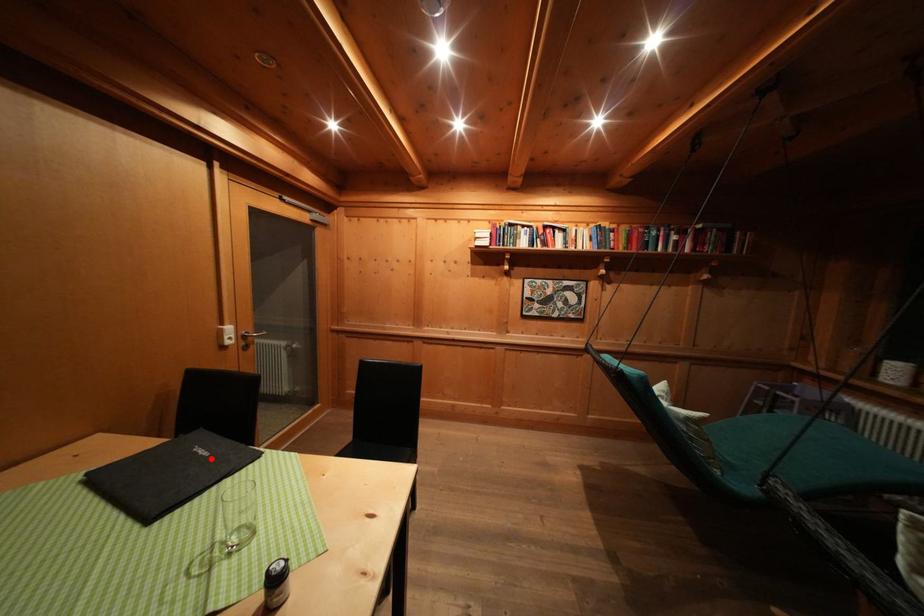
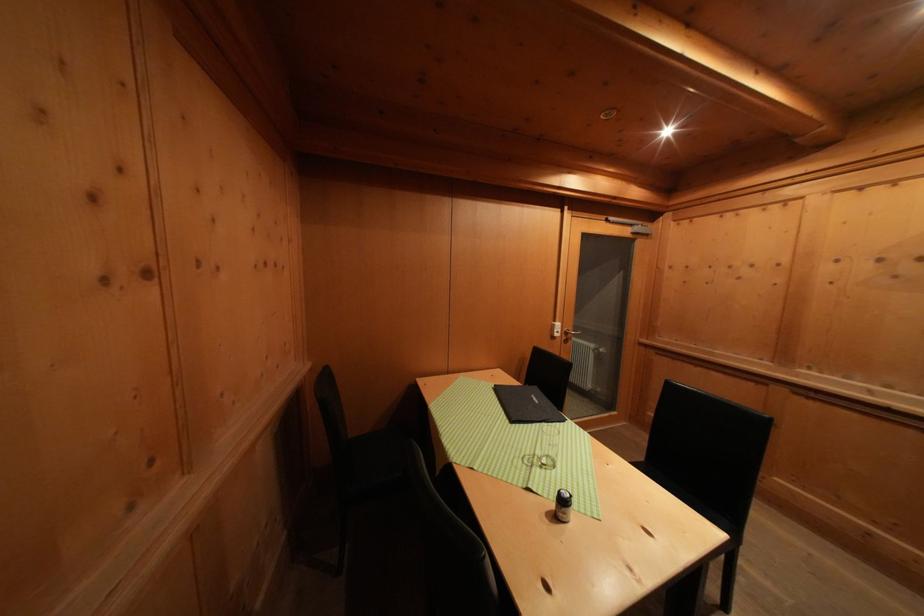
The point at the highlighted location is marked in the first image. Where is the corresponding point in the second image?

(542, 406)